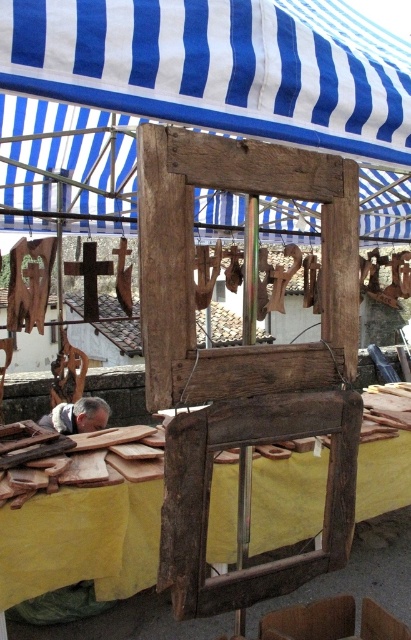
Question: Is blue striped fabric at upper center to the right of gray fabric at lower left from the viewer's perspective?

Choices:
 (A) no
 (B) yes

Answer: (B)

Question: Can you confirm if blue striped fabric at upper center is positioned to the right of gray fabric at lower left?

Choices:
 (A) no
 (B) yes

Answer: (B)

Question: Among these objects, which one is farthest from the camera?

Choices:
 (A) gray fabric at lower left
 (B) blue striped fabric at upper center

Answer: (A)

Question: Which point is farther to the camera?

Choices:
 (A) blue striped fabric at upper center
 (B) gray fabric at lower left

Answer: (B)

Question: Is blue striped fabric at upper center positioned before gray fabric at lower left?

Choices:
 (A) yes
 (B) no

Answer: (A)